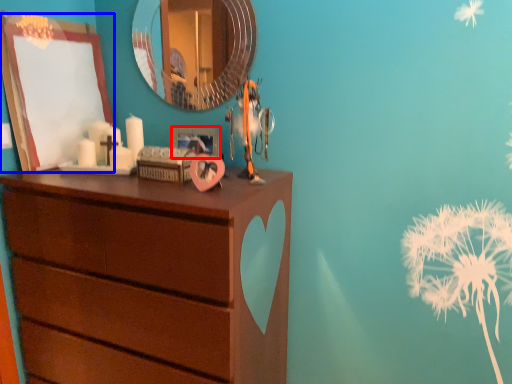
Question: Which object is closer to the camera taking this photo, picture frame (highlighted by a red box) or picture frame (highlighted by a blue box)?

Choices:
 (A) picture frame
 (B) picture frame

Answer: (B)